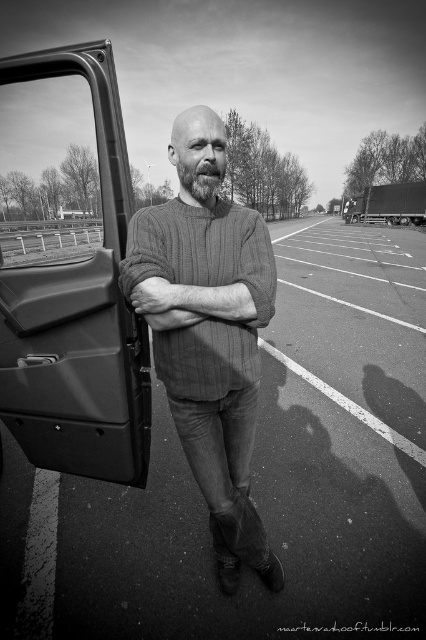
Question: Is the position of matte plastic car door at left less distant than that of metallic truck at upper right?

Choices:
 (A) yes
 (B) no

Answer: (A)

Question: Is smooth asphalt parking lot at center below bearded at center?

Choices:
 (A) no
 (B) yes

Answer: (B)

Question: Which is nearer to the metallic truck at upper right?

Choices:
 (A) bearded at center
 (B) knitted sweater at center
 (C) smooth asphalt parking lot at center

Answer: (C)

Question: Can you confirm if matte plastic car door at left is wider than metallic truck at upper right?

Choices:
 (A) yes
 (B) no

Answer: (A)

Question: Based on their relative distances, which object is nearer to the smooth asphalt parking lot at center?

Choices:
 (A) knitted sweater at center
 (B) matte plastic car door at left

Answer: (A)

Question: Based on their relative distances, which object is farther from the smooth asphalt parking lot at center?

Choices:
 (A) metallic truck at upper right
 (B) bearded at center

Answer: (A)